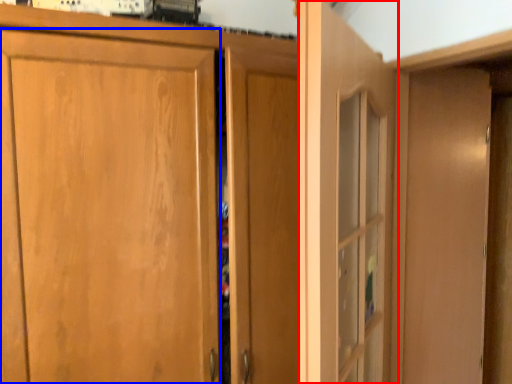
Question: Among these objects, which one is farthest to the camera, door (highlighted by a red box) or door (highlighted by a blue box)?

Choices:
 (A) door
 (B) door

Answer: (B)